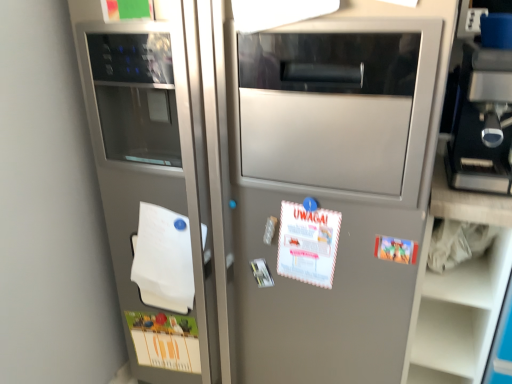
Question: Should I look upward or downward to see matte plastic postcard at right, positioned as the 3th postcard in left-to-right order?

Choices:
 (A) up
 (B) down

Answer: (B)

Question: From the image's perspective, is white paper at center, the 2th postcard viewed from the back, located beneath white matte notepad at left?

Choices:
 (A) yes
 (B) no

Answer: (B)

Question: Is white paper at center, the first postcard when ordered from top to bottom, to the right of white matte notepad at left from the viewer's perspective?

Choices:
 (A) yes
 (B) no

Answer: (A)

Question: Is white paper at center, which is counted as the 3th postcard, starting from the bottom, not within white matte notepad at left?

Choices:
 (A) no
 (B) yes

Answer: (B)

Question: From a real-world perspective, is white paper at center, which is counted as the 3th postcard, starting from the bottom, physically below white matte notepad at left?

Choices:
 (A) yes
 (B) no

Answer: (B)

Question: Is the depth of white paper at center, the second postcard viewed from the front, less than that of white matte notepad at left?

Choices:
 (A) no
 (B) yes

Answer: (B)

Question: Does white paper at center, the first postcard when ordered from top to bottom, have a smaller size compared to white matte notepad at left?

Choices:
 (A) no
 (B) yes

Answer: (B)

Question: Is the position of matte plastic postcard at right, marked as the first postcard in a front-to-back arrangement, less distant than that of matte paper postcard at lower left, the 3th postcard in the top-to-bottom sequence?

Choices:
 (A) yes
 (B) no

Answer: (A)

Question: Is matte plastic postcard at right, which ranks as the third postcard in back-to-front order, directly adjacent to matte paper postcard at lower left, arranged as the first postcard when viewed from the left?

Choices:
 (A) yes
 (B) no

Answer: (B)

Question: Does matte plastic postcard at right, which ranks as the third postcard in back-to-front order, come behind matte paper postcard at lower left, which is counted as the 1th postcard, starting from the bottom?

Choices:
 (A) no
 (B) yes

Answer: (A)

Question: Is matte plastic postcard at right, arranged as the second postcard when ordered from the bottom, bigger than matte paper postcard at lower left, arranged as the first postcard when viewed from the left?

Choices:
 (A) yes
 (B) no

Answer: (B)

Question: Is matte plastic postcard at right, placed as the first postcard when sorted from right to left, looking in the opposite direction of matte paper postcard at lower left, the 3th postcard in the right-to-left sequence?

Choices:
 (A) yes
 (B) no

Answer: (B)

Question: From the image's perspective, is matte plastic postcard at right, which is the 2th postcard from top to bottom, over matte paper postcard at lower left, which is counted as the 1th postcard, starting from the bottom?

Choices:
 (A) no
 (B) yes

Answer: (B)

Question: Is white matte notepad at left wider than white paper at center, the second postcard viewed from the front?

Choices:
 (A) yes
 (B) no

Answer: (A)